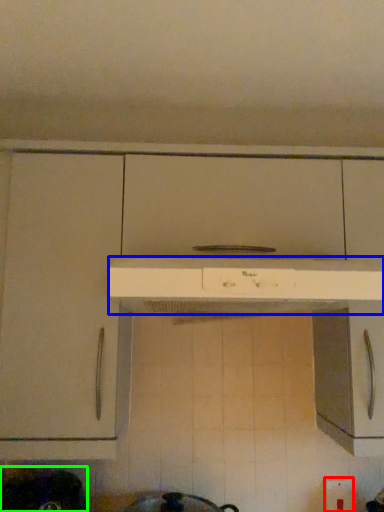
Question: Considering the real-world distances, which object is farthest from electric outlet (highlighted by a red box)? home appliance (highlighted by a blue box) or appliance (highlighted by a green box)?

Choices:
 (A) home appliance
 (B) appliance

Answer: (B)